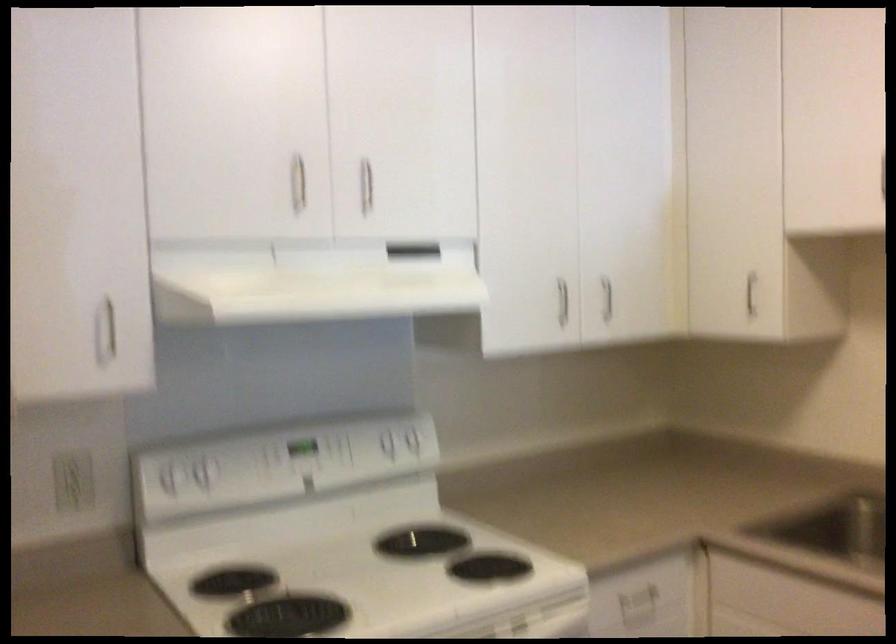
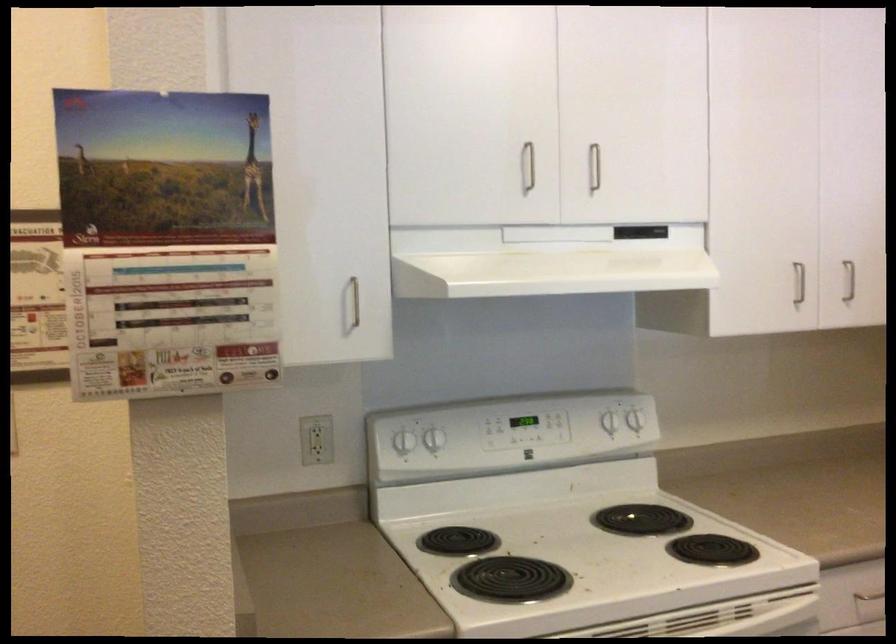
The point at (167, 471) is marked in the first image. Where is the corresponding point in the second image?

(400, 433)